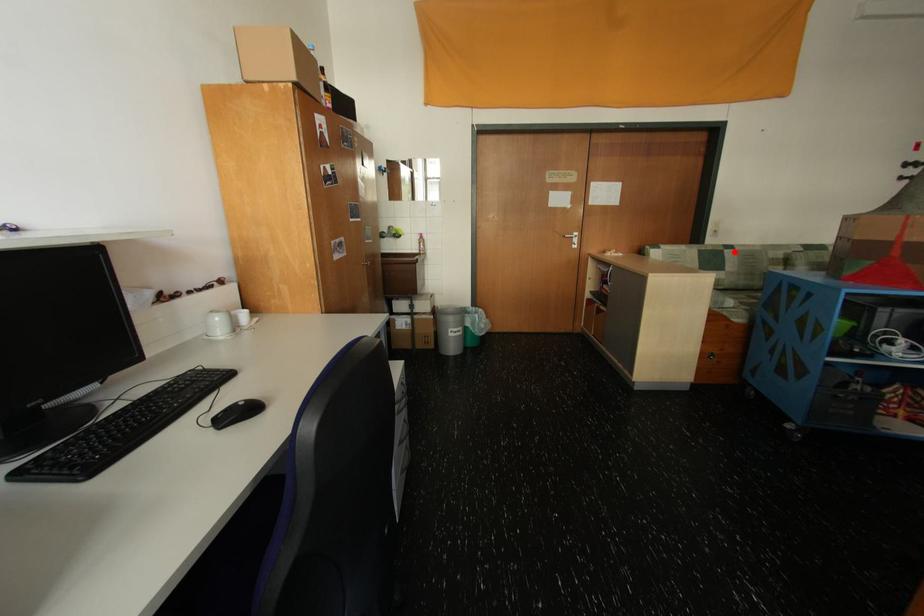
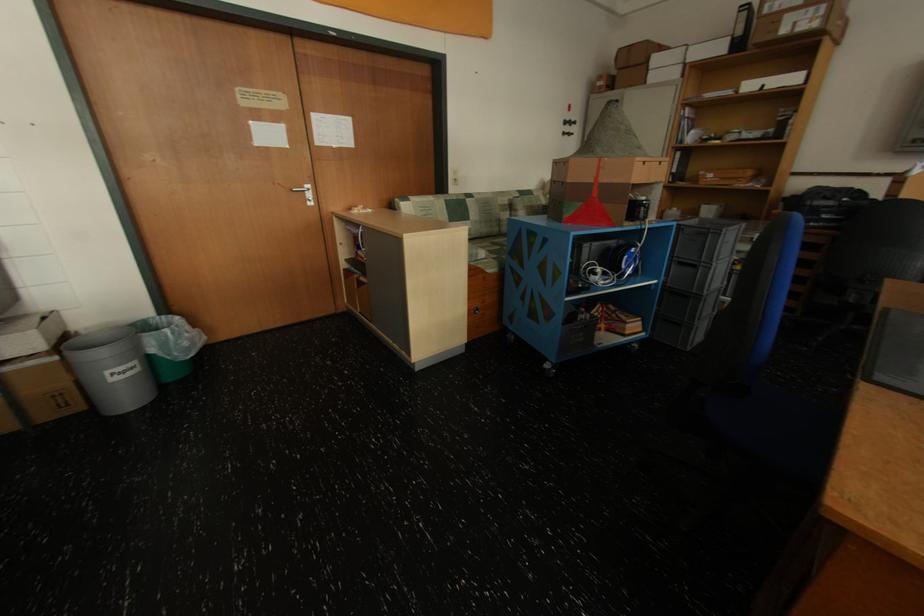
Question: I am providing you with two images of the same scene from different viewpoints. Given a red point in image1, look at the same physical point in image2. Is it:

Choices:
 (A) Closer to the viewpoint
 (B) Farther from the viewpoint

Answer: (A)